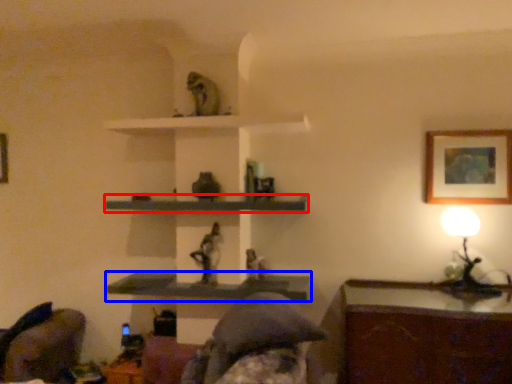
Question: Which point is further to the camera, shelf (highlighted by a red box) or shelf (highlighted by a blue box)?

Choices:
 (A) shelf
 (B) shelf

Answer: (B)